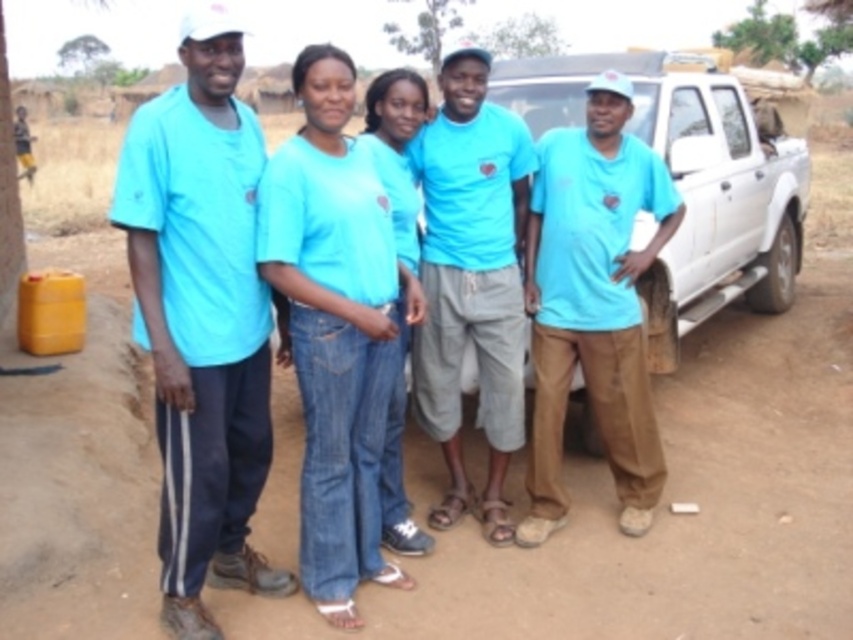
What are the coordinates of `matte blue shirt at left` in the screenshot? It's located at (201, 316).

Which is behind, point (215, 497) or point (381, 408)?

Positioned behind is point (381, 408).

Which is behind, point (262, 300) or point (347, 582)?

The point (347, 582) is behind.

The width and height of the screenshot is (853, 640). What are the coordinates of `matte blue shirt at left` in the screenshot? It's located at (201, 316).

Is matte blue shirt at left smaller than matte blue shirt at right?

Yes.

Can you confirm if matte blue shirt at left is positioned to the left of matte blue shirt at right?

Yes, matte blue shirt at left is to the left of matte blue shirt at right.

Where is `matte blue shirt at left`? This screenshot has height=640, width=853. matte blue shirt at left is located at coordinates (201, 316).

Where is `matte blue shirt at left`? matte blue shirt at left is located at coordinates (201, 316).

Who is shorter, blue denim jeans at center or matte blue shirt at right?

matte blue shirt at right

Between point (332, 285) and point (567, 285), which one is positioned behind?

Positioned behind is point (567, 285).

Where is `blue denim jeans at center`? The height and width of the screenshot is (640, 853). blue denim jeans at center is located at coordinates (335, 326).